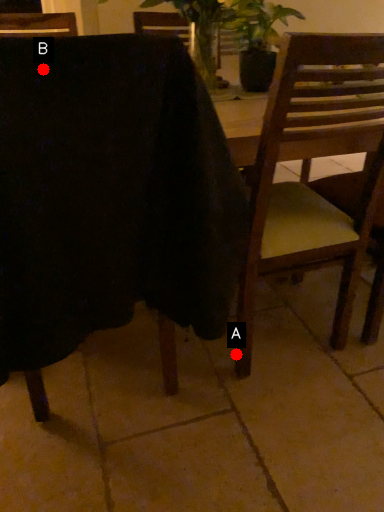
Question: Two points are circled on the image, labeled by A and B beside each circle. Which point appears closest to the camera in this image?

Choices:
 (A) A is closer
 (B) B is closer

Answer: (B)